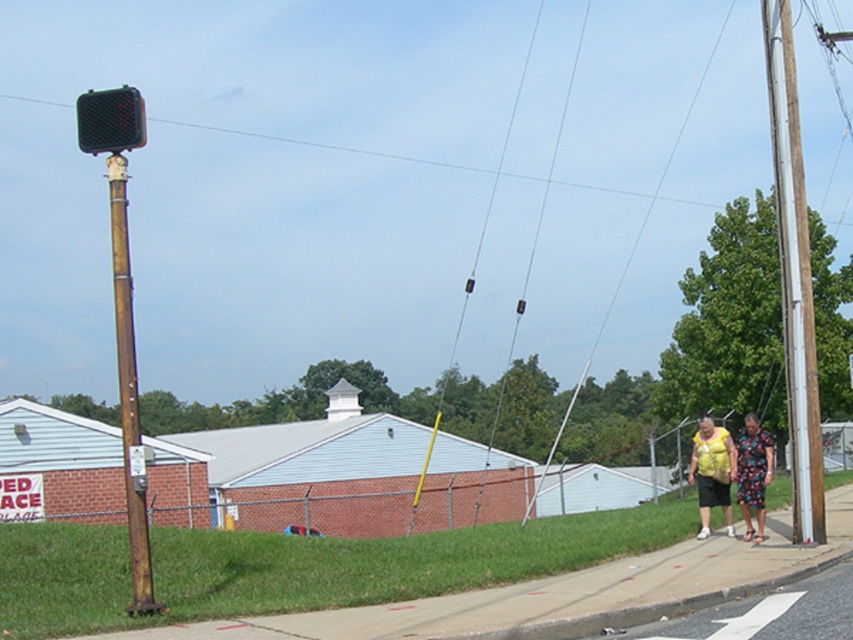
You are standing at the entrance of the brick building and want to find the rusty metal pole at left. According to the coordinates provided, in which direction should you walk to reach it?

The rusty metal pole at left is located at point coordinates with an x value of 0.613 and y value of 0.151. Since the x coordinate is greater than 0.5, you should walk to the right from the entrance to reach the rusty metal pole at left.

You are standing at the sidewalk in the suburban scene. There is a point marked at coordinates (125, 272). If you want to reach this point as quickly as possible, should you walk towards the building with the light blue roof and red brick walls or towards the sign on the left?

You should walk towards the building with the light blue roof and red brick walls because the point (125, 272) is 30.88 feet away from the viewer, which is closer than the sign on the left.